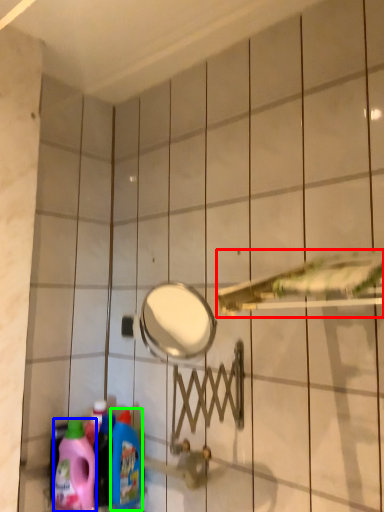
Question: Based on their relative distances, which object is farther from shower (highlighted by a red box)? Choose from cleaning product (highlighted by a blue box) and cleaning product (highlighted by a green box).

Choices:
 (A) cleaning product
 (B) cleaning product

Answer: (A)